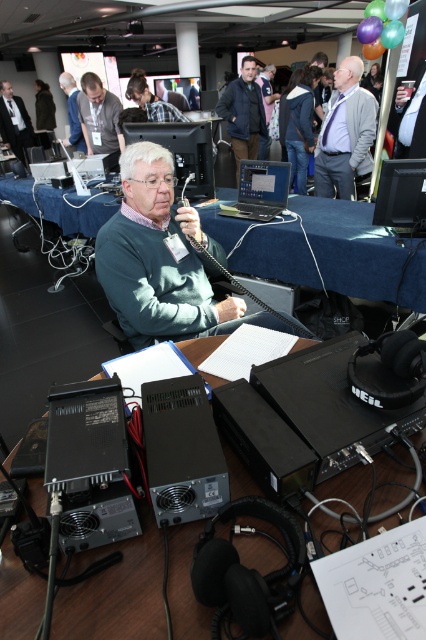
Question: Is dark blue jacket at center wider than matte black laptop at center?

Choices:
 (A) yes
 (B) no

Answer: (A)

Question: Does black plastic monitor at center have a greater width compared to silver metallic laptop at center?

Choices:
 (A) yes
 (B) no

Answer: (B)

Question: Where is matte black laptop at center located in relation to dark brown leather jacket at upper left in the image?

Choices:
 (A) below
 (B) above

Answer: (A)

Question: Among these points, which one is farthest from the camera?

Choices:
 (A) click(23, 118)
 (B) click(302, 72)

Answer: (A)

Question: Among these objects, which one is nearest to the camera?

Choices:
 (A) black plastic speaker at lower center
 (B) green matte sweater at center
 (C) matte black laptop at upper left

Answer: (A)

Question: Which object is positioned farthest from the matte black laptop at center?

Choices:
 (A) gray fabric tie at upper center
 (B) black plastic table at center

Answer: (A)